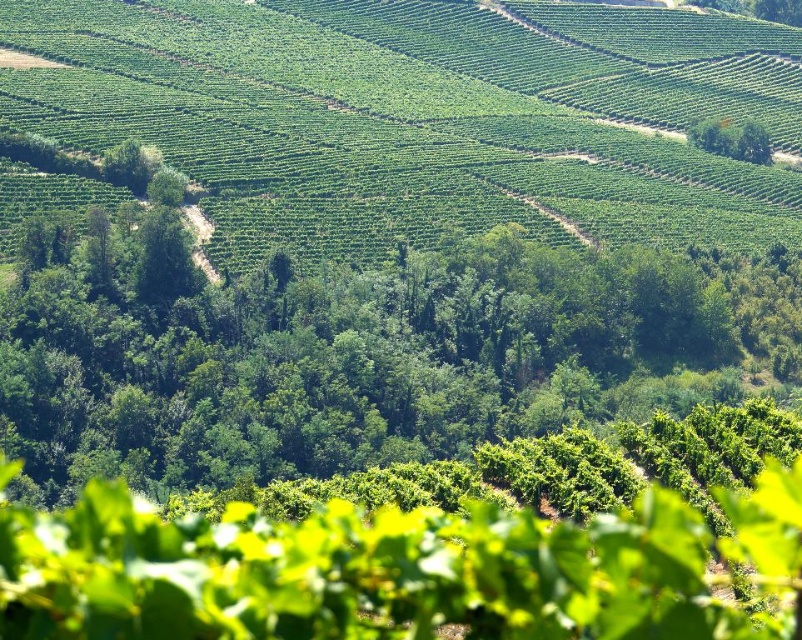
You are a hiker planning to walk from the green leafy tree at center to the green leafy hillside at center. What is the approximate distance you need to cover?

The green leafy hillside at center is 125.07 feet away from the green leafy tree at center, so the hiker needs to cover approximately 125.07 feet.

Based on the scene description, which object is taller between the green leafy hillside at center and the green leafy tree at center?

The green leafy hillside at center is taller than the green leafy tree at center according to the description.

You are a photographer standing in the vineyard and want to capture both the green leafy hillside at center and the green leafy tree at center in your photo. Which one appears higher in the frame?

The green leafy hillside at center is above the green leafy tree at center, so it will appear higher in the frame.